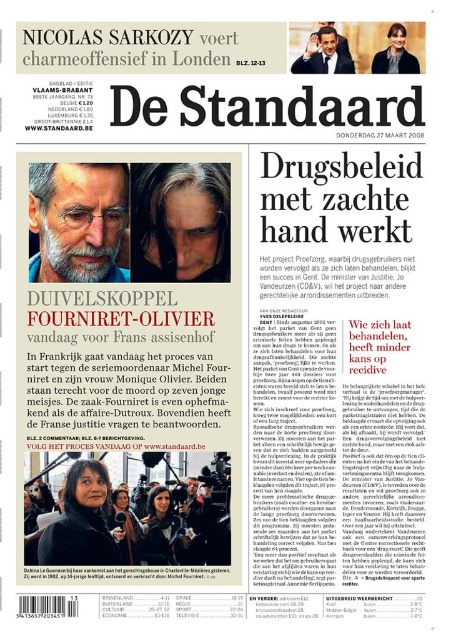
Based on the newspaper layout described, can you determine the spatial relationship between the matte black hair at upper center and the matte black face at upper center?

The matte black hair at upper center is located below the matte black face at upper center.

What is the spatial coordinate of the matte black hair at upper center in the newspaper layout?

The matte black hair at upper center is located at the coordinate point of (82, 522).

Based on the scene described, what is the significance of the point marked at coordinates (181, 221)?

The point marked at coordinates (181, 221) indicates the location of gray hair at upper center.